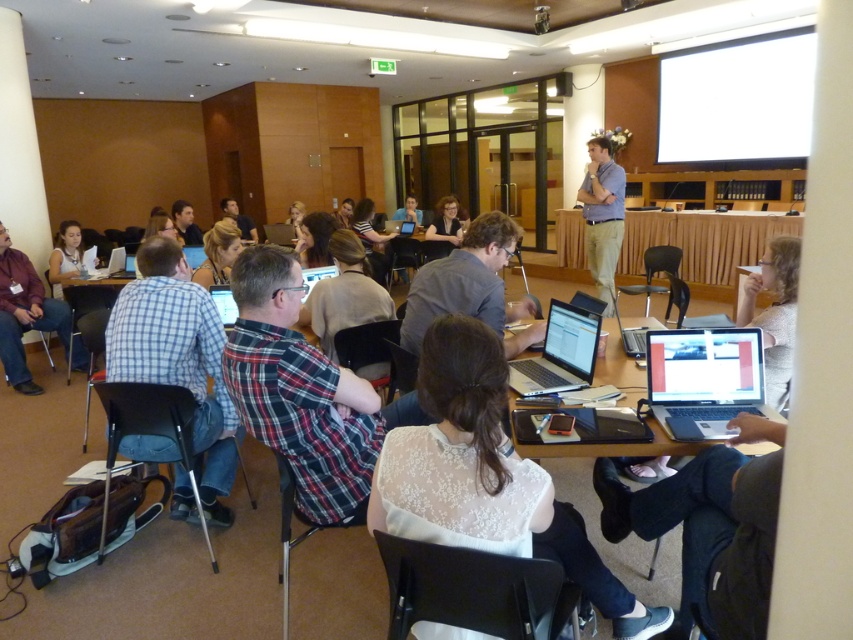
You are a participant in the conference room and need to retrieve your silver metallic laptop at lower right. You are currently standing next to the silver metallic laptop at center. Which direction should you move to reach your laptop?

You should move to your left because the silver metallic laptop at lower right is positioned to the left of the silver metallic laptop at center.

What are the coordinates of the checkered fabric shirt at left in the image?

The checkered fabric shirt at left is located at coordinates (177, 358).

You are standing in the conference room and see a point at coordinates (177, 358). According to the scene description, what object is this point located on?

The point at coordinates (177, 358) is located on the checkered fabric shirt at left.